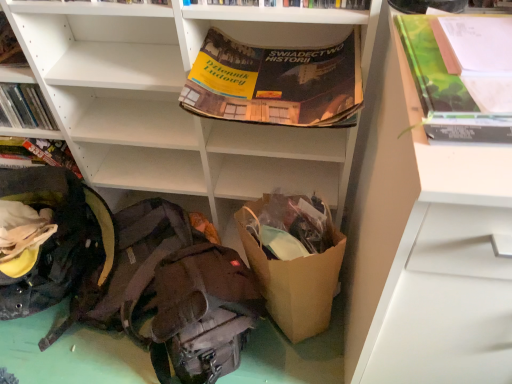
Identify the location of hardcover book at upper center, which is the 1th book in right-to-left order. The image size is (512, 384). 288,3.

What is the approximate height of dark gray fabric backpack at lower left, positioned as the 2th backpack in right-to-left order?

It is 6.63 inches.

Image resolution: width=512 pixels, height=384 pixels. What do you see at coordinates (198, 313) in the screenshot? I see `dark brown fabric backpack at lower left, the third backpack from the left` at bounding box center [198, 313].

You are a GUI agent. You are given a task and a screenshot of the screen. Output one action in this format:
    pyautogui.click(x=<x>, y=<y>)
    Task: Click on the hardcover book at upper center, which is the first book from top to bottom
    The image size is (512, 384).
    Given the screenshot: What is the action you would take?
    pyautogui.click(x=288, y=3)

Based on the photo, is yellow paper at upper center, positioned as the second paperback book in front-to-back order, positioned with its back to dark brown fabric backpack at lower left, the third backpack from the left?

No, yellow paper at upper center, positioned as the second paperback book in front-to-back order, is not facing away from dark brown fabric backpack at lower left, the third backpack from the left.

Are yellow paper at upper center, positioned as the second paperback book in front-to-back order, and dark brown fabric backpack at lower left, the 1th backpack when ordered from right to left, making contact?

No, yellow paper at upper center, positioned as the second paperback book in front-to-back order, is not making contact with dark brown fabric backpack at lower left, the 1th backpack when ordered from right to left.

From the image's perspective, would you say yellow paper at upper center, which is counted as the first paperback book, starting from the left, is shown under dark brown fabric backpack at lower left, the 1th backpack when ordered from right to left?

Actually, yellow paper at upper center, which is counted as the first paperback book, starting from the left, appears above dark brown fabric backpack at lower left, the 1th backpack when ordered from right to left, in the image.

Does dark gray fabric backpack at lower left, which is counted as the 3th backpack, starting from the right, have a greater height compared to white matte drawer at right, the 2th shelf in the left-to-right sequence?

No, dark gray fabric backpack at lower left, which is counted as the 3th backpack, starting from the right, is not taller than white matte drawer at right, the 2th shelf in the left-to-right sequence.

Considering the sizes of objects dark gray fabric backpack at lower left, the 1th backpack from the left, and white matte drawer at right, the 1th shelf in the right-to-left sequence, in the image provided, who is wider, dark gray fabric backpack at lower left, the 1th backpack from the left, or white matte drawer at right, the 1th shelf in the right-to-left sequence,?

white matte drawer at right, the 1th shelf in the right-to-left sequence, is wider.

Measure the distance between dark gray fabric backpack at lower left, which is counted as the 3th backpack, starting from the right, and white matte drawer at right, the 1th shelf in the right-to-left sequence.

A distance of 78.28 centimeters exists between dark gray fabric backpack at lower left, which is counted as the 3th backpack, starting from the right, and white matte drawer at right, the 1th shelf in the right-to-left sequence.

Is dark gray fabric backpack at lower left, which is counted as the 3th backpack, starting from the right, positioned beyond the bounds of white matte drawer at right, the 2th shelf in the left-to-right sequence?

That's correct, dark gray fabric backpack at lower left, which is counted as the 3th backpack, starting from the right, is outside of white matte drawer at right, the 2th shelf in the left-to-right sequence.

From the picture: Considering the sizes of objects dark brown fabric backpack at lower left, the 1th backpack when ordered from right to left, and hardcover book at upper center, which is the 1th book in right-to-left order, in the image provided, who is shorter, dark brown fabric backpack at lower left, the 1th backpack when ordered from right to left, or hardcover book at upper center, which is the 1th book in right-to-left order,?

hardcover book at upper center, which is the 1th book in right-to-left order, is shorter.

Identify the location of book in front of the dark brown fabric backpack at lower left, the third backpack from the left. (288, 3).

Do you think dark brown fabric backpack at lower left, the 1th backpack when ordered from right to left, is within hardcover book at upper center, which is the first book from top to bottom, or outside of it?

dark brown fabric backpack at lower left, the 1th backpack when ordered from right to left, exists outside the volume of hardcover book at upper center, which is the first book from top to bottom.

Considering the positions of points (315, 317) and (210, 282), is point (315, 317) farther from camera compared to point (210, 282)?

Yes, it is behind point (210, 282).

Considering the positions of objects brown paper bag at lower center and dark brown fabric backpack at lower left, the third backpack from the left, in the image provided, who is behind, brown paper bag at lower center or dark brown fabric backpack at lower left, the third backpack from the left,?

brown paper bag at lower center.

From the image's perspective, which one is positioned lower, brown paper bag at lower center or dark brown fabric backpack at lower left, the third backpack from the left?

dark brown fabric backpack at lower left, the third backpack from the left, is shown below in the image.

Is brown paper bag at lower center taller than dark brown fabric backpack at lower left, the third backpack from the left?

Yes.

From the image's perspective, which object appears higher, white matte shelf at upper center, positioned as the 1th shelf in left-to-right order, or white matte drawer at right, the 2th shelf in the left-to-right sequence?

white matte shelf at upper center, positioned as the 1th shelf in left-to-right order.

Which object is further away from the camera taking this photo, white matte shelf at upper center, which ranks as the second shelf in right-to-left order, or white matte drawer at right, the 1th shelf in the right-to-left sequence?

white matte shelf at upper center, which ranks as the second shelf in right-to-left order, is further away from the camera.

Which of these two, white matte shelf at upper center, which ranks as the second shelf in right-to-left order, or white matte drawer at right, the 2th shelf in the left-to-right sequence, is bigger?

Bigger between the two is white matte drawer at right, the 2th shelf in the left-to-right sequence.

Which object is positioned more to the left, white matte shelf at upper center, positioned as the 1th shelf in left-to-right order, or white matte drawer at right, the 2th shelf in the left-to-right sequence?

Positioned to the left is white matte shelf at upper center, positioned as the 1th shelf in left-to-right order.

From a real-world perspective, which is physically below, yellow paper at upper center, arranged as the first paperback book when viewed from the back, or brown paper bag at lower center?

brown paper bag at lower center is physically lower.

Which object is positioned more to the right, yellow paper at upper center, which ranks as the 2th paperback book in right-to-left order, or brown paper bag at lower center?

Positioned to the right is brown paper bag at lower center.

Does yellow paper at upper center, positioned as the second paperback book in front-to-back order, have a greater height compared to brown paper bag at lower center?

No, yellow paper at upper center, positioned as the second paperback book in front-to-back order, is not taller than brown paper bag at lower center.

Relative to brown paper bag at lower center, is yellow paper at upper center, which is counted as the first paperback book, starting from the left, in front or behind?

Clearly, yellow paper at upper center, which is counted as the first paperback book, starting from the left, is in front of brown paper bag at lower center.

Identify the location of cardboard box on the left of the green matte book at upper right, which is counted as the 2th paperback book, starting from the left. (294, 280).

Is green matte book at upper right, which is counted as the 2th paperback book, starting from the left, at the back of brown paper bag at lower center?

No, brown paper bag at lower center is not facing the opposite direction of green matte book at upper right, which is counted as the 2th paperback book, starting from the left.

Is brown paper bag at lower center bigger than green matte book at upper right, which is the 2th paperback book in back-to-front order?

Yes, brown paper bag at lower center is bigger than green matte book at upper right, which is the 2th paperback book in back-to-front order.

Is brown paper bag at lower center wider than green matte book at upper right, the 1th paperback book in the right-to-left sequence?

No.

Locate an element on the screen. Image resolution: width=512 pixels, height=384 pixels. paperback book that is the 2nd one when counting upward from the dark brown fabric backpack at lower left, the 1th backpack when ordered from right to left (from the image's perspective) is located at coordinates (274, 83).

From the white matte drawer at right, the 1th shelf in the right-to-left sequence, count the 3rd backpack to the left and point to it. Please provide its 2D coordinates.

[(57, 239)]

From the image, which object appears to be farther from hardcover book at left, the first book viewed from the back, dark gray fabric backpack at lower left, which is counted as the 3th backpack, starting from the right, or white matte drawer at right, the 1th shelf in the right-to-left sequence?

white matte drawer at right, the 1th shelf in the right-to-left sequence.

Looking at the image, which one is located further to white matte drawer at right, the 1th shelf in the right-to-left sequence, hardcover book at upper center, which is counted as the first book, starting from the front, or dark brown fabric backpack at lower left, the 1th backpack when ordered from right to left?

hardcover book at upper center, which is counted as the first book, starting from the front, is further to white matte drawer at right, the 1th shelf in the right-to-left sequence.

Looking at the image, which one is located closer to white matte shelf at upper center, positioned as the 1th shelf in left-to-right order, hardcover book at upper center, which is counted as the first book, starting from the front, or dark gray fabric backpack at lower left, marked as the 2th backpack in a left-to-right arrangement?

dark gray fabric backpack at lower left, marked as the 2th backpack in a left-to-right arrangement.

Based on their spatial positions, is dark brown fabric backpack at lower left, the third backpack from the left, or dark gray fabric backpack at lower left, positioned as the 2th backpack in right-to-left order, further from green matte book at upper right, which is counted as the 2th paperback book, starting from the left?

dark gray fabric backpack at lower left, positioned as the 2th backpack in right-to-left order.

Estimate the real-world distances between objects in this image. Which object is closer to yellow paper at upper center, which is counted as the first paperback book, starting from the left, green matte book at upper right, which is counted as the 2th paperback book, starting from the left, or white matte shelf at upper center, which ranks as the second shelf in right-to-left order?

Based on the image, white matte shelf at upper center, which ranks as the second shelf in right-to-left order, appears to be nearer to yellow paper at upper center, which is counted as the first paperback book, starting from the left.

Looking at the image, which one is located closer to white matte drawer at right, the 1th shelf in the right-to-left sequence, white matte shelf at upper center, positioned as the 1th shelf in left-to-right order, or hardcover book at left, the first book viewed from the back?

white matte shelf at upper center, positioned as the 1th shelf in left-to-right order, is positioned closer to the anchor white matte drawer at right, the 1th shelf in the right-to-left sequence.

From the image, which object appears to be nearer to dark gray fabric backpack at lower left, the 1th backpack from the left, green matte book at upper right, which is counted as the 1th paperback book, starting from the front, or brown paper bag at lower center?

brown paper bag at lower center lies closer to dark gray fabric backpack at lower left, the 1th backpack from the left, than the other object.

Which object lies nearer to the anchor point dark gray fabric backpack at lower left, positioned as the 2th backpack in right-to-left order, hardcover book at upper center, which is the first book from top to bottom, or white matte shelf at upper center, positioned as the 1th shelf in left-to-right order?

white matte shelf at upper center, positioned as the 1th shelf in left-to-right order.

The height and width of the screenshot is (384, 512). Identify the location of book located between dark gray fabric backpack at lower left, which is counted as the 3th backpack, starting from the right, and brown paper bag at lower center in the left-right direction. (288, 3).

The height and width of the screenshot is (384, 512). I want to click on shelf located between hardcover book at left, the 2th book viewed from the top, and yellow paper at upper center, which is counted as the first paperback book, starting from the left, in the left-right direction, so click(177, 97).

What are the coordinates of `book that lies between hardcover book at upper center, marked as the second book in a back-to-front arrangement, and dark brown fabric backpack at lower left, the 1th backpack when ordered from right to left, from top to bottom` in the screenshot? It's located at (37, 153).

Locate an element on the screen. The image size is (512, 384). shelf located between dark gray fabric backpack at lower left, the 1th backpack from the left, and hardcover book at upper center, which is the 1th book in right-to-left order, in the left-right direction is located at coordinates (177, 97).